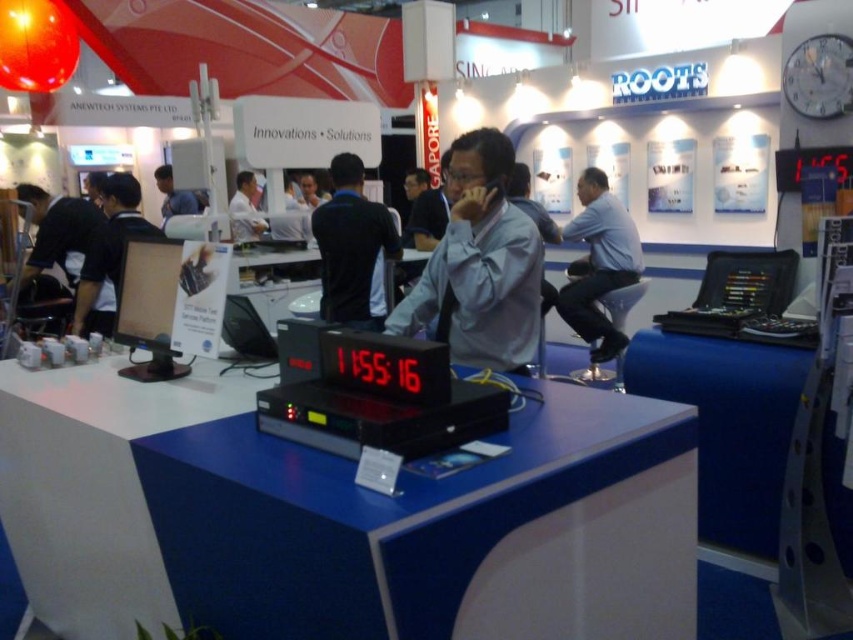
Which is above, gray matte shirt at center or white plastic clock at upper right?

white plastic clock at upper right is higher up.

Between gray matte shirt at center and white plastic clock at upper right, which one has less height?

Standing shorter between the two is white plastic clock at upper right.

Is point (496, 147) farther from camera compared to point (788, 76)?

That is False.

The image size is (853, 640). What are the coordinates of `gray matte shirt at center` in the screenshot? It's located at (480, 262).

Can you confirm if black fabric shirt at center is wider than white plastic clock at upper right?

Yes.

The height and width of the screenshot is (640, 853). What do you see at coordinates (350, 244) in the screenshot? I see `black fabric shirt at center` at bounding box center [350, 244].

Identify the location of black fabric shirt at center. (350, 244).

Is gray matte shirt at center smaller than black fabric shirt at center?

Yes.

Does gray matte shirt at center have a greater width compared to black fabric shirt at center?

Indeed, gray matte shirt at center has a greater width compared to black fabric shirt at center.

Is point (468, 164) positioned before point (392, 220)?

Yes, it is in front of point (392, 220).

You are a GUI agent. You are given a task and a screenshot of the screen. Output one action in this format:
    pyautogui.click(x=<x>, y=<y>)
    Task: Click on the gray matte shirt at center
    Image resolution: width=853 pixels, height=640 pixels.
    Given the screenshot: What is the action you would take?
    pyautogui.click(x=480, y=262)